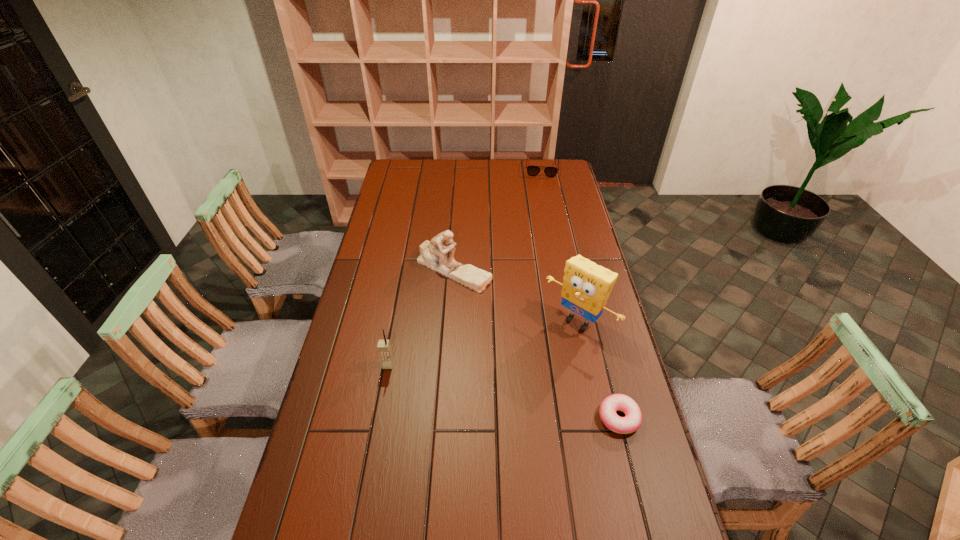
The image size is (960, 540). Find the location of `free space on the desktop that is between the leftmost object and the doughnut and is positioned on the front-facing side of the fourth object from right to left`. free space on the desktop that is between the leftmost object and the doughnut and is positioned on the front-facing side of the fourth object from right to left is located at coordinates (478, 386).

Where is `vacant spot on the desktop that is between the leftmost object and the nearest object and is positioned on the front-facing side of the spectacles`? Image resolution: width=960 pixels, height=540 pixels. vacant spot on the desktop that is between the leftmost object and the nearest object and is positioned on the front-facing side of the spectacles is located at coordinates (529, 397).

Find the location of a particular element. The width and height of the screenshot is (960, 540). vacant space on the desktop that is between the second nearest object and the doughnut and is positioned on the face of the tallest object is located at coordinates (511, 393).